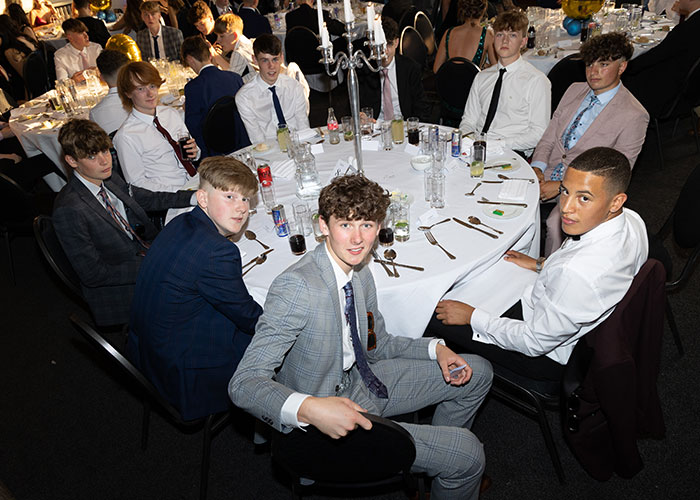
Where is `candlestick`? candlestick is located at coordinates (353, 94).